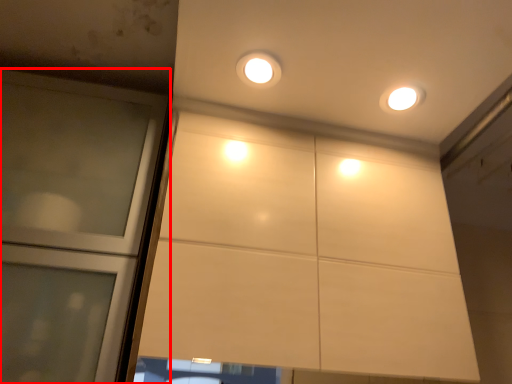
Question: From the image's perspective, what is the correct spatial positioning of door (annotated by the red box) in reference to dot?

Choices:
 (A) below
 (B) above

Answer: (A)